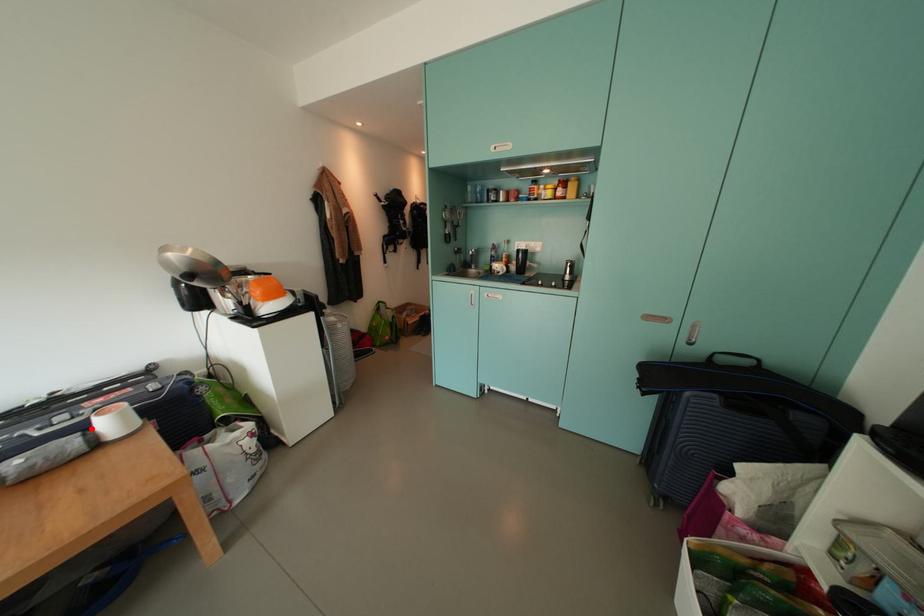
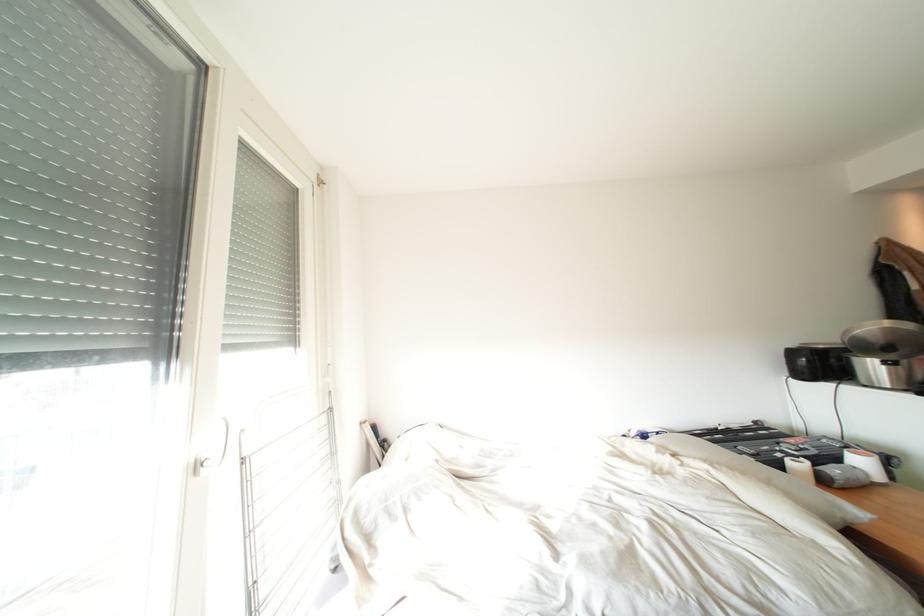
Question: I am providing you with two images of the same scene from different viewpoints. A red point is shown in image1. For the corresponding object point in image2, is it positioned nearer or farther from the camera?

Choices:
 (A) Nearer
 (B) Farther

Answer: (A)